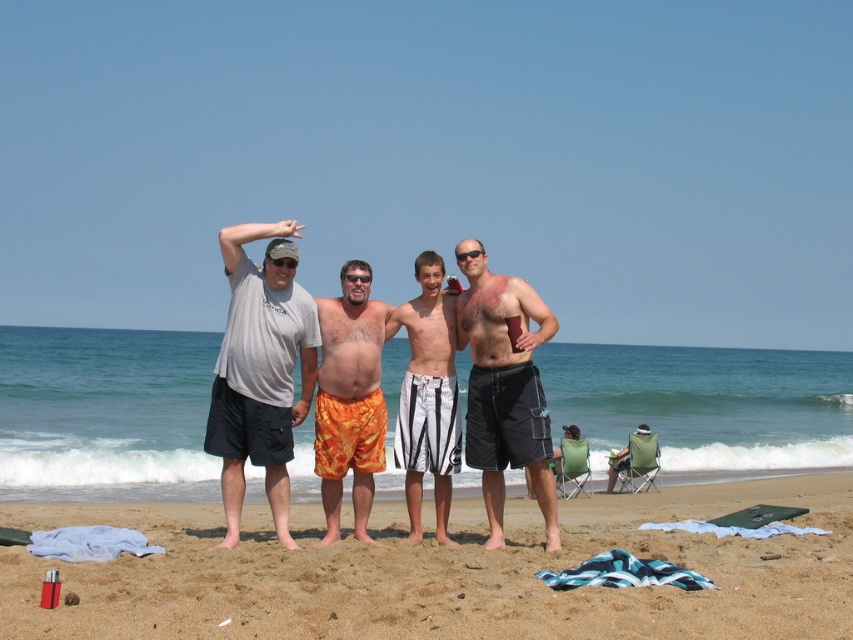
Question: Which of these objects is positioned farthest from the gray t-shirt at left?

Choices:
 (A) matte black shorts at center
 (B) orange printed shorts at center
 (C) white striped shorts at center

Answer: (A)

Question: Which object appears farthest from the camera in this image?

Choices:
 (A) white striped shorts at center
 (B) orange printed shorts at center
 (C) matte black shorts at center
 (D) gray t-shirt at left

Answer: (A)

Question: Is gray t-shirt at left positioned in front of white striped shorts at center?

Choices:
 (A) no
 (B) yes

Answer: (B)

Question: Which object is farther from the camera taking this photo?

Choices:
 (A) matte black shorts at center
 (B) beige sand at center
 (C) gray t-shirt at left

Answer: (A)

Question: In this image, where is orange printed shorts at center located relative to white striped shorts at center?

Choices:
 (A) left
 (B) right

Answer: (A)

Question: Does beige sand at center appear over matte black shorts at center?

Choices:
 (A) no
 (B) yes

Answer: (A)